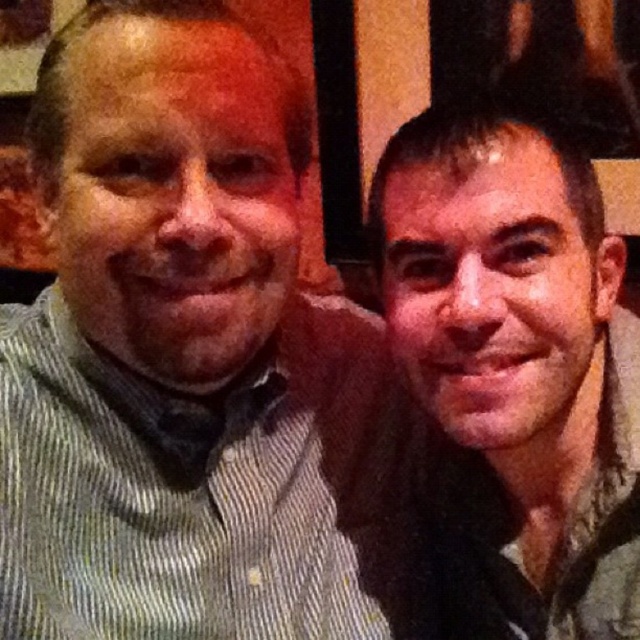
You are a photographer trying to adjust the lighting for a photo shoot. You notice the striped cotton shirt at left and the matte gray scarf at right in the frame. Which object should you focus on first if you want to ensure proper exposure, considering their positions?

The striped cotton shirt at left should be focused on first because it is positioned over the matte gray scarf at right, meaning it is closer to the camera and requires attention to ensure proper exposure.

You are a photographer trying to capture a group photo of two people wearing the striped cotton shirt at left and the matte gray scarf at right. Which clothing item is located more to the left side of the scene?

The striped cotton shirt at left is positioned on the left side of the matte gray scarf at right, so it is more to the left.

You are a photographer trying to adjust the lighting for a photo shoot. You notice the striped cotton shirt at left and the matte gray scarf at right in the frame. Which object should you focus on first if you want to ensure proper exposure for the larger item?

The striped cotton shirt at left has a larger size compared to the matte gray scarf at right, so you should focus on the striped cotton shirt at left first to ensure proper exposure for the larger item.